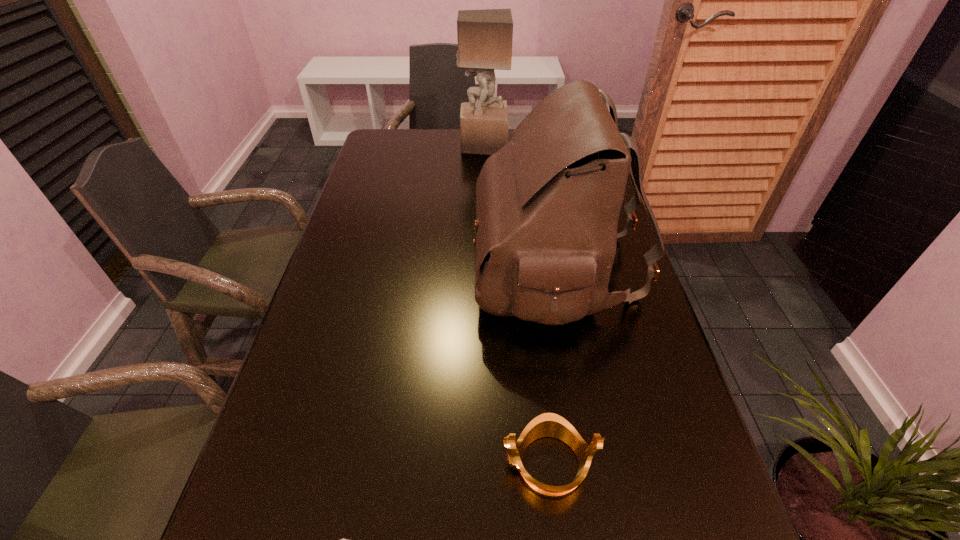
You are a GUI agent. You are given a task and a screenshot of the screen. Output one action in this format:
    pyautogui.click(x=<x>, y=<y>)
    Task: Click on the sculpture
    This screenshot has width=960, height=540.
    Given the screenshot: What is the action you would take?
    pyautogui.click(x=485, y=36)

Image resolution: width=960 pixels, height=540 pixels. I want to click on satchel, so click(x=547, y=203).

Where is `detergent`? This screenshot has height=540, width=960. detergent is located at coordinates (599, 90).

Where is `the second farthest object`? The height and width of the screenshot is (540, 960). the second farthest object is located at coordinates (599, 90).

I want to click on the fourth farthest object, so click(548, 424).

I want to click on vacant region located on the front-facing side of the sculpture, so click(404, 145).

The width and height of the screenshot is (960, 540). I want to click on vacant space located 0.210m on the front-facing side of the sculpture, so click(x=401, y=145).

Where is `vacant area located on the front-facing side of the sculpture`? The height and width of the screenshot is (540, 960). vacant area located on the front-facing side of the sculpture is located at coordinates (443, 145).

The width and height of the screenshot is (960, 540). I want to click on vacant space situated on the front flap of the third farthest object, so click(411, 267).

Identify the location of vacant space situated 0.100m on the front flap of the third farthest object. This screenshot has width=960, height=540. (435, 267).